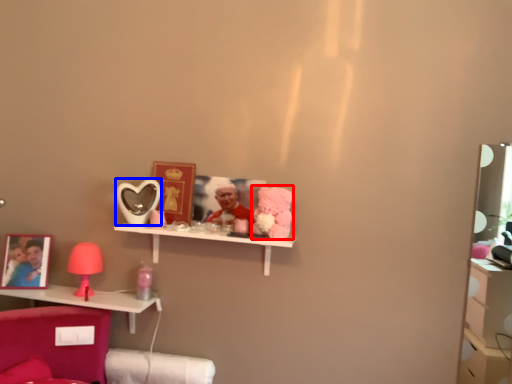
Question: Which object appears closest to the camera in this image, toy (highlighted by a red box) or mirror (highlighted by a blue box)?

Choices:
 (A) toy
 (B) mirror

Answer: (A)